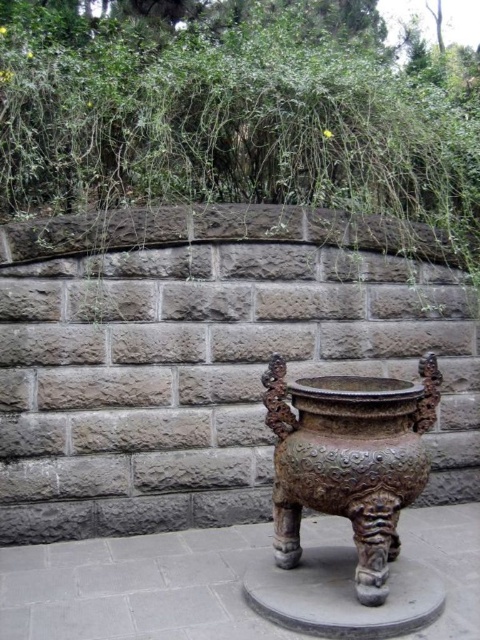
You are standing in front of the bronze censer and notice a point marked at coordinates [228,122]. Based on the scene description, can you identify what this point is located on?

The point [228,122] is located on green leafy vegetation at upper center.

You are a gardener who wants to plant a new shrub that requires at least 3 feet of space. You see the green leafy vegetation at upper center and the bronze textured pot at center. Which object provides enough vertical space for the shrub?

The green leafy vegetation at upper center is much taller as bronze textured pot at center, so the green leafy vegetation at upper center provides enough vertical space for the shrub.